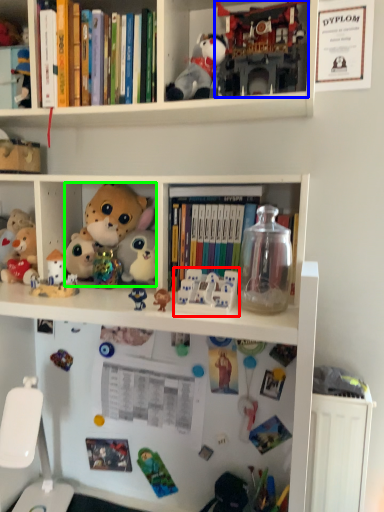
Question: Which is farther away from toy (highlighted by a red box)? toy (highlighted by a blue box) or toy (highlighted by a green box)?

Choices:
 (A) toy
 (B) toy

Answer: (A)